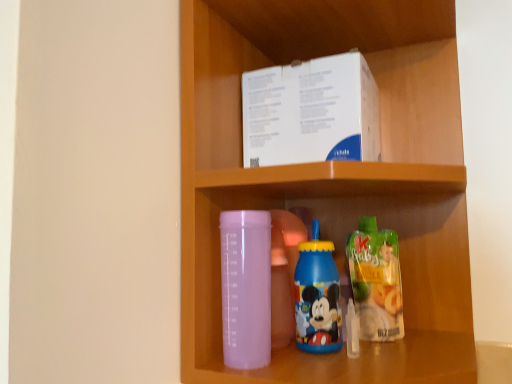
Where is `white paperboard box at upper center`? This screenshot has height=384, width=512. white paperboard box at upper center is located at coordinates (311, 112).

Where is `blue plastic bottle at center, which is counted as the 2th bottle, starting from the right`? This screenshot has height=384, width=512. blue plastic bottle at center, which is counted as the 2th bottle, starting from the right is located at coordinates (317, 299).

Can you confirm if translucent plastic juice at lower right, placed as the third bottle when sorted from left to right, is shorter than matte plastic bottle at lower center?

Yes, translucent plastic juice at lower right, placed as the third bottle when sorted from left to right, is shorter than matte plastic bottle at lower center.

Is translucent plastic juice at lower right, placed as the third bottle when sorted from left to right, bigger than matte plastic bottle at lower center?

Actually, translucent plastic juice at lower right, placed as the third bottle when sorted from left to right, might be smaller than matte plastic bottle at lower center.

Would you say translucent plastic juice at lower right, placed as the third bottle when sorted from left to right, is inside or outside matte plastic bottle at lower center?

translucent plastic juice at lower right, placed as the third bottle when sorted from left to right, is contained in matte plastic bottle at lower center.

From a real-world perspective, is translucent plastic juice at lower right, placed as the third bottle when sorted from left to right, located higher than matte plastic bottle at lower center?

No.

Can you confirm if matte plastic bottle at lower center is shorter than transparent plastic bottle at center, the third bottle positioned from the right?

No.

From a real-world perspective, which object stands above the other?

matte plastic bottle at lower center.

Is matte plastic bottle at lower center turned away from transparent plastic bottle at center, the first bottle positioned from the left?

Absolutely, matte plastic bottle at lower center is directed away from transparent plastic bottle at center, the first bottle positioned from the left.

From the image's perspective, between matte plastic bottle at lower center and transparent plastic bottle at center, the first bottle positioned from the left, who is located below?

transparent plastic bottle at center, the first bottle positioned from the left, from the image's perspective.

From the image's perspective, would you say blue plastic bottle at center, which is counted as the 2th bottle, starting from the right, is positioned over matte plastic bottle at lower center?

No.

In the scene shown: Would you say blue plastic bottle at center, which is counted as the 2th bottle, starting from the right, is inside or outside matte plastic bottle at lower center?

The correct answer is: inside.

Does blue plastic bottle at center, which is counted as the 2th bottle, starting from the right, have a lesser height compared to matte plastic bottle at lower center?

Yes, blue plastic bottle at center, which is counted as the 2th bottle, starting from the right, is shorter than matte plastic bottle at lower center.

Which is closer to the camera, (319,329) or (348,211)?

Positioned in front is point (319,329).

Is transparent plastic bottle at center, the first bottle positioned from the left, closer to camera compared to translucent plastic juice at lower right, placed as the third bottle when sorted from left to right?

Yes, it is in front of translucent plastic juice at lower right, placed as the third bottle when sorted from left to right.

Do you think transparent plastic bottle at center, the third bottle positioned from the right, is within translucent plastic juice at lower right, placed as the third bottle when sorted from left to right, or outside of it?

transparent plastic bottle at center, the third bottle positioned from the right, is not inside translucent plastic juice at lower right, placed as the third bottle when sorted from left to right, it's outside.

Starting from the translucent plastic juice at lower right, which is the 1th bottle in right-to-left order, which bottle is the 1st one in front? Please provide its 2D coordinates.

[(246, 288)]

Which object is positioned more to the right, translucent plastic juice at lower right, which is the 1th bottle in right-to-left order, or blue plastic bottle at center, which is counted as the 2th bottle, starting from the right?

translucent plastic juice at lower right, which is the 1th bottle in right-to-left order.

From the image's perspective, is translucent plastic juice at lower right, placed as the third bottle when sorted from left to right, located above or below blue plastic bottle at center, which is counted as the 2th bottle, starting from the right?

Clearly, from the image's perspective, translucent plastic juice at lower right, placed as the third bottle when sorted from left to right, is below blue plastic bottle at center, which is counted as the 2th bottle, starting from the right.

From their relative heights in the image, would you say translucent plastic juice at lower right, which is the 1th bottle in right-to-left order, is taller or shorter than blue plastic bottle at center, which is counted as the 2th bottle, starting from the right?

In the image, translucent plastic juice at lower right, which is the 1th bottle in right-to-left order, appears to be shorter than blue plastic bottle at center, which is counted as the 2th bottle, starting from the right.

Considering the sizes of objects matte plastic bottle at lower center and translucent plastic juice at lower right, placed as the third bottle when sorted from left to right, in the image provided, who is smaller, matte plastic bottle at lower center or translucent plastic juice at lower right, placed as the third bottle when sorted from left to right,?

With smaller size is translucent plastic juice at lower right, placed as the third bottle when sorted from left to right.

Where is `shelf above the translucent plastic juice at lower right, placed as the third bottle when sorted from left to right (from the image's perspective)`? The height and width of the screenshot is (384, 512). shelf above the translucent plastic juice at lower right, placed as the third bottle when sorted from left to right (from the image's perspective) is located at coordinates (331, 178).

Considering the points (201, 224) and (400, 293), which point is behind, point (201, 224) or point (400, 293)?

Point (400, 293)

Considering the relative sizes of white paperboard box at upper center and blue plastic bottle at center, which is counted as the 2th bottle, starting from the right, in the image provided, is white paperboard box at upper center bigger than blue plastic bottle at center, which is counted as the 2th bottle, starting from the right,?

Correct, white paperboard box at upper center is larger in size than blue plastic bottle at center, which is counted as the 2th bottle, starting from the right.

Is point (338, 100) closer or farther from the camera than point (304, 321)?

Point (338, 100).

From the image's perspective, between white paperboard box at upper center and blue plastic bottle at center, which is counted as the 2th bottle, starting from the right, which one is located above?

white paperboard box at upper center, from the image's perspective.

From a real-world perspective, is white paperboard box at upper center physically below blue plastic bottle at center, the 2th bottle in the left-to-right sequence?

No, from a real-world perspective, white paperboard box at upper center is not below blue plastic bottle at center, the 2th bottle in the left-to-right sequence.

The width and height of the screenshot is (512, 384). Find the location of `shelf that is above the translucent plastic juice at lower right, which is the 1th bottle in right-to-left order (from the image's perspective)`. shelf that is above the translucent plastic juice at lower right, which is the 1th bottle in right-to-left order (from the image's perspective) is located at coordinates (331, 178).

The width and height of the screenshot is (512, 384). Identify the location of the 3rd bottle below when counting from the matte plastic bottle at lower center (from the image's perspective). (246, 288).

Based on their spatial positions, is transparent plastic bottle at center, the third bottle positioned from the right, or blue plastic bottle at center, the 2th bottle in the left-to-right sequence, further from white paperboard box at upper center?

Based on the image, blue plastic bottle at center, the 2th bottle in the left-to-right sequence, appears to be further to white paperboard box at upper center.

Looking at the image, which one is located further to transparent plastic bottle at center, the first bottle positioned from the left, matte plastic bottle at lower center or translucent plastic juice at lower right, which is the 1th bottle in right-to-left order?

matte plastic bottle at lower center.

Estimate the real-world distances between objects in this image. Which object is further from white paperboard box at upper center, matte plastic bottle at lower center or translucent plastic juice at lower right, placed as the third bottle when sorted from left to right?

Among the two, translucent plastic juice at lower right, placed as the third bottle when sorted from left to right, is located further to white paperboard box at upper center.

From the image, which object appears to be farther from transparent plastic bottle at center, the first bottle positioned from the left, matte plastic bottle at lower center or white paperboard box at upper center?

Based on the image, matte plastic bottle at lower center appears to be further to transparent plastic bottle at center, the first bottle positioned from the left.

Looking at the image, which one is located closer to translucent plastic juice at lower right, which is the 1th bottle in right-to-left order, matte plastic bottle at lower center or transparent plastic bottle at center, the third bottle positioned from the right?

matte plastic bottle at lower center is positioned closer to the anchor translucent plastic juice at lower right, which is the 1th bottle in right-to-left order.

Which object lies further to the anchor point transparent plastic bottle at center, the third bottle positioned from the right, translucent plastic juice at lower right, which is the 1th bottle in right-to-left order, or white paperboard box at upper center?

Based on the image, translucent plastic juice at lower right, which is the 1th bottle in right-to-left order, appears to be further to transparent plastic bottle at center, the third bottle positioned from the right.

Considering their positions, is matte plastic bottle at lower center positioned closer to blue plastic bottle at center, which is counted as the 2th bottle, starting from the right, than transparent plastic bottle at center, the third bottle positioned from the right?

Based on the image, transparent plastic bottle at center, the third bottle positioned from the right, appears to be nearer to blue plastic bottle at center, which is counted as the 2th bottle, starting from the right.

Looking at the image, which one is located closer to translucent plastic juice at lower right, which is the 1th bottle in right-to-left order, matte plastic bottle at lower center or blue plastic bottle at center, the 2th bottle in the left-to-right sequence?

Based on the image, blue plastic bottle at center, the 2th bottle in the left-to-right sequence, appears to be nearer to translucent plastic juice at lower right, which is the 1th bottle in right-to-left order.

I want to click on shelf between white paperboard box at upper center and blue plastic bottle at center, which is counted as the 2th bottle, starting from the right, vertically, so click(331, 178).

This screenshot has height=384, width=512. What are the coordinates of `bottle that lies between white paperboard box at upper center and translucent plastic juice at lower right, placed as the third bottle when sorted from left to right, from top to bottom` in the screenshot? It's located at (317, 299).

Where is `shelf between white paperboard box at upper center and transparent plastic bottle at center, the first bottle positioned from the left, in the vertical direction`? shelf between white paperboard box at upper center and transparent plastic bottle at center, the first bottle positioned from the left, in the vertical direction is located at coordinates (331, 178).

Locate an element on the screen. bottle between transparent plastic bottle at center, the first bottle positioned from the left, and translucent plastic juice at lower right, which is the 1th bottle in right-to-left order is located at coordinates (317, 299).